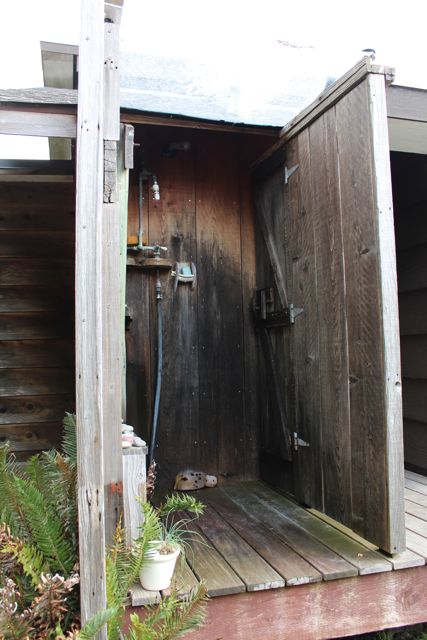
You are a GUI agent. You are given a task and a screenshot of the screen. Output one action in this format:
    pyautogui.click(x=<x>, y=<y>)
    Task: Click on the shower
    
    Given the screenshot: What is the action you would take?
    pyautogui.click(x=155, y=198)